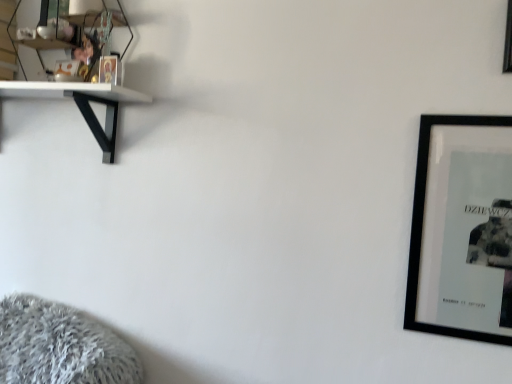
Question: Is clear glass shelf at upper left outside of black matte picture frame at right, positioned as the first picture frame in bottom-to-top order?

Choices:
 (A) yes
 (B) no

Answer: (A)

Question: Is clear glass shelf at upper left further to camera compared to black matte picture frame at right, positioned as the first picture frame in bottom-to-top order?

Choices:
 (A) no
 (B) yes

Answer: (B)

Question: Does clear glass shelf at upper left have a lesser height compared to black matte picture frame at right, the second picture frame viewed from the top?

Choices:
 (A) yes
 (B) no

Answer: (A)

Question: Is clear glass shelf at upper left placed right next to black matte picture frame at right, positioned as the first picture frame in bottom-to-top order?

Choices:
 (A) no
 (B) yes

Answer: (A)

Question: Does clear glass shelf at upper left have a larger size compared to black matte picture frame at right, the second picture frame viewed from the top?

Choices:
 (A) yes
 (B) no

Answer: (A)

Question: Does clear glass shelf at upper left lie in front of black matte picture frame at right, the second picture frame viewed from the top?

Choices:
 (A) yes
 (B) no

Answer: (B)

Question: Can you confirm if black matte picture frame at upper right, acting as the second picture frame starting from the bottom, is smaller than black matte picture frame at right, the second picture frame viewed from the top?

Choices:
 (A) no
 (B) yes

Answer: (B)

Question: Is black matte picture frame at upper right, which is the 1th picture frame in top-to-bottom order, facing away from black matte picture frame at right, the second picture frame viewed from the top?

Choices:
 (A) yes
 (B) no

Answer: (B)

Question: Does black matte picture frame at upper right, which is the 1th picture frame in top-to-bottom order, have a lesser height compared to black matte picture frame at right, positioned as the first picture frame in bottom-to-top order?

Choices:
 (A) no
 (B) yes

Answer: (B)

Question: Considering the relative sizes of black matte picture frame at upper right, acting as the second picture frame starting from the bottom, and black matte picture frame at right, the second picture frame viewed from the top, in the image provided, is black matte picture frame at upper right, acting as the second picture frame starting from the bottom, bigger than black matte picture frame at right, the second picture frame viewed from the top,?

Choices:
 (A) yes
 (B) no

Answer: (B)

Question: From a real-world perspective, is black matte picture frame at upper right, which is the 1th picture frame in top-to-bottom order, physically below black matte picture frame at right, positioned as the first picture frame in bottom-to-top order?

Choices:
 (A) no
 (B) yes

Answer: (A)

Question: Is black matte picture frame at upper right, acting as the second picture frame starting from the bottom, taller than black matte picture frame at right, positioned as the first picture frame in bottom-to-top order?

Choices:
 (A) yes
 (B) no

Answer: (B)

Question: Is black matte picture frame at right, the second picture frame viewed from the top, not near black matte picture frame at upper right, acting as the second picture frame starting from the bottom?

Choices:
 (A) yes
 (B) no

Answer: (B)